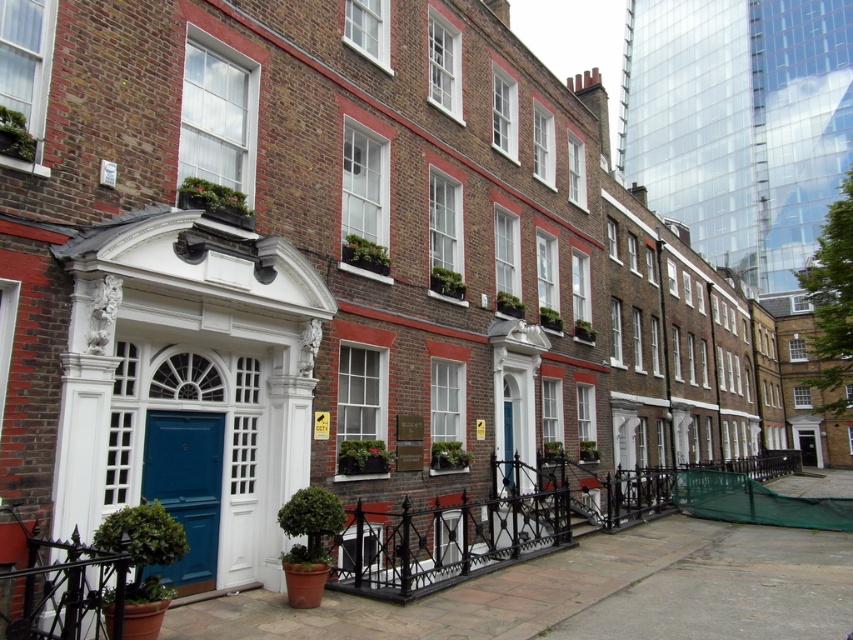
Question: Does black wrought iron fence at center appear over blue glossy door at center?

Choices:
 (A) no
 (B) yes

Answer: (A)

Question: Which point appears farthest from the camera in this image?

Choices:
 (A) (216, 448)
 (B) (518, 541)

Answer: (B)

Question: Which point is farther from the camera taking this photo?

Choices:
 (A) (547, 541)
 (B) (160, 435)

Answer: (A)

Question: Can you confirm if black wrought iron fence at center is positioned below blue glossy door at center?

Choices:
 (A) yes
 (B) no

Answer: (A)

Question: Can you confirm if black wrought iron fence at center is positioned above blue glossy door at center?

Choices:
 (A) yes
 (B) no

Answer: (B)

Question: Which of the following is the farthest from the observer?

Choices:
 (A) (177, 586)
 (B) (614, 502)

Answer: (B)